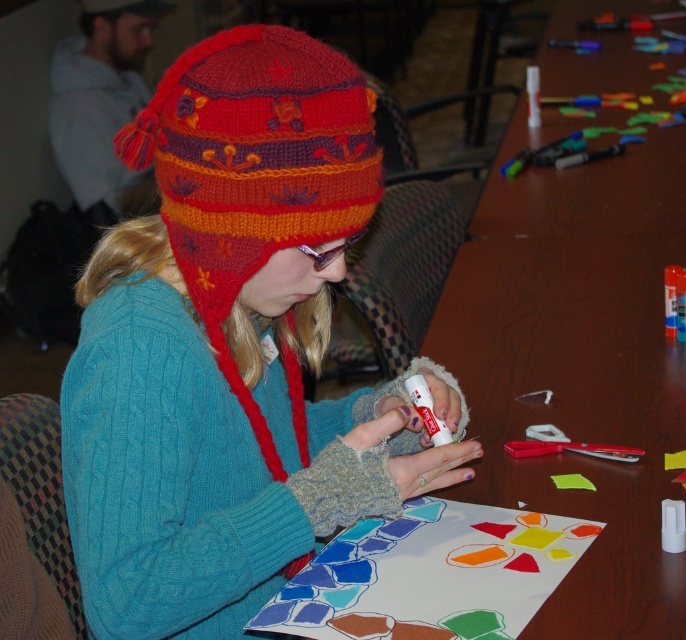
Question: Which of the following is the farthest from the observer?

Choices:
 (A) (508, 182)
 (B) (99, 528)

Answer: (A)

Question: Among these objects, which one is nearest to the camera?

Choices:
 (A) wooden table at center
 (B) knitted woolen hat at center

Answer: (B)

Question: Which object appears farthest from the camera in this image?

Choices:
 (A) wooden table at center
 (B) knitted woolen hat at center

Answer: (A)

Question: Does knitted woolen hat at center appear over wooden table at center?

Choices:
 (A) yes
 (B) no

Answer: (B)

Question: Does knitted woolen hat at center have a smaller size compared to wooden table at center?

Choices:
 (A) yes
 (B) no

Answer: (A)

Question: Does knitted woolen hat at center have a smaller size compared to wooden table at center?

Choices:
 (A) yes
 (B) no

Answer: (A)